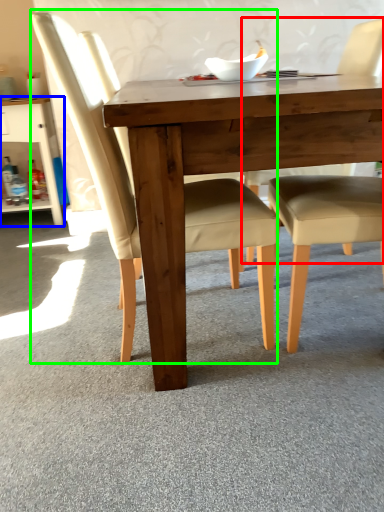
Question: Which is nearer to the chair (highlighted by a red box)? dresser (highlighted by a blue box) or chair (highlighted by a green box).

Choices:
 (A) dresser
 (B) chair

Answer: (B)